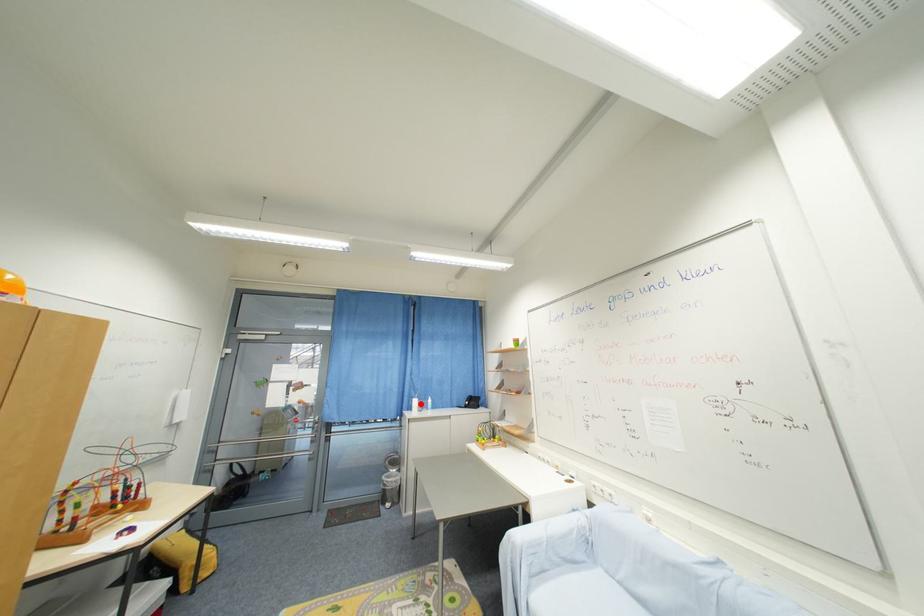
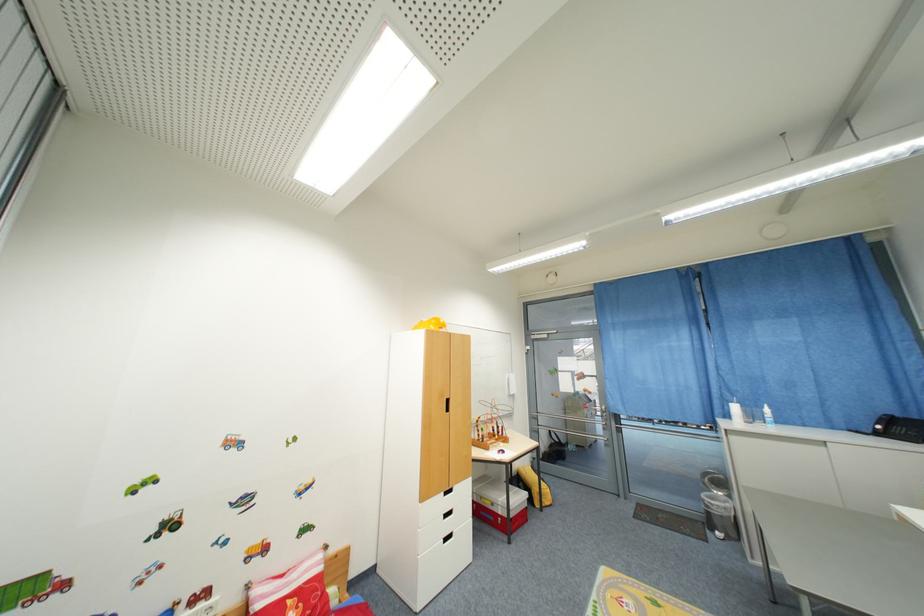
Question: I am providing you with two images of the same scene from different viewpoints. Given a red point in image1, look at the same physical point in image2. Is it:

Choices:
 (A) Closer to the viewpoint
 (B) Farther from the viewpoint

Answer: (A)